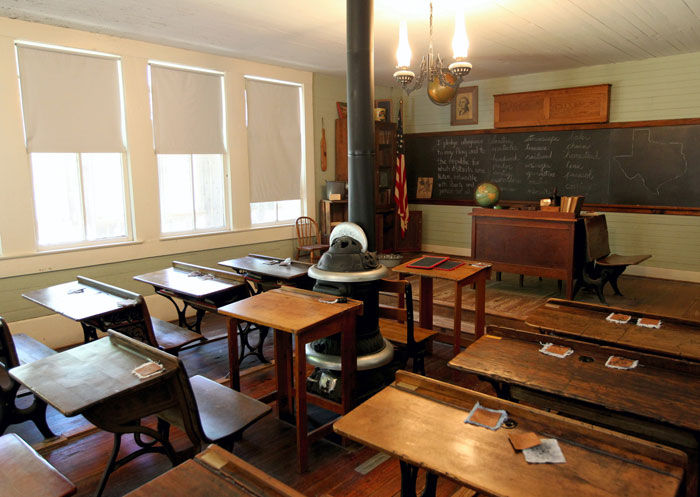
This screenshot has width=700, height=497. What are the coordinates of `seats` in the screenshot? It's located at (38, 476), (24, 342), (234, 405), (402, 330), (241, 278), (309, 242), (631, 261).